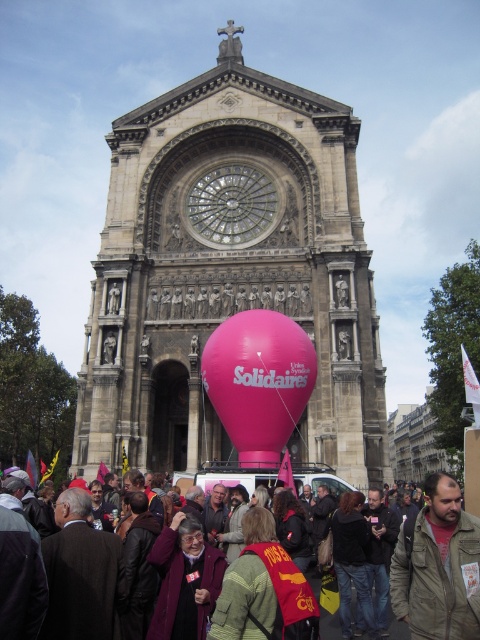
You are attending an event in front of the cathedral and notice two objects at the center. Which one is taller, the pink matte balloon at center or the clear glass clock at center?

The pink matte balloon at center is taller than the clear glass clock at center according to the description.

You are a photographer standing in front of the cathedral. You want to take a photo of the pink matte balloon at center and the brown textured jacket at lower right. Which object is positioned higher in the frame?

The pink matte balloon at center is above the brown textured jacket at lower right, so it is positioned higher in the frame.

You are a photographer trying to capture the pink matte balloon at center and the brown textured jacket at lower right in the same frame. Which object should you focus on first to ensure both are in the frame without moving the camera?

The pink matte balloon at center is bigger than the brown textured jacket at lower right, so you should focus on the pink matte balloon at center first to ensure it fits within the frame before checking the visibility of the brown textured jacket at lower right.